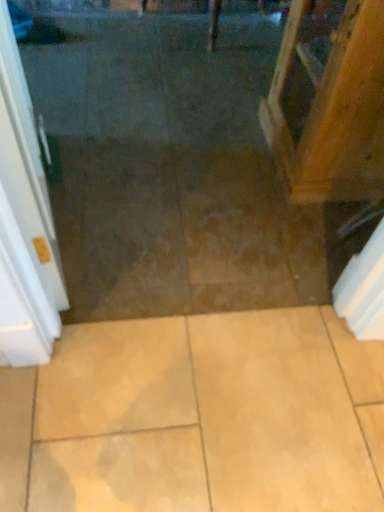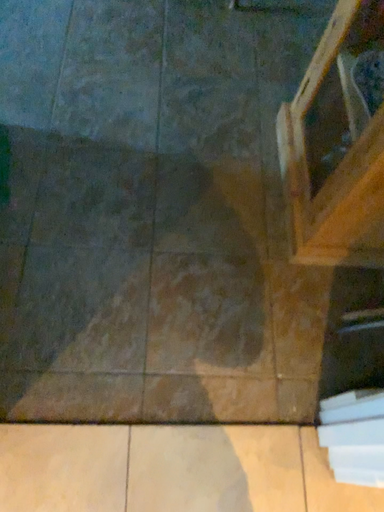
Question: How did the camera likely rotate when shooting the video?

Choices:
 (A) rotated downward
 (B) rotated upward

Answer: (A)